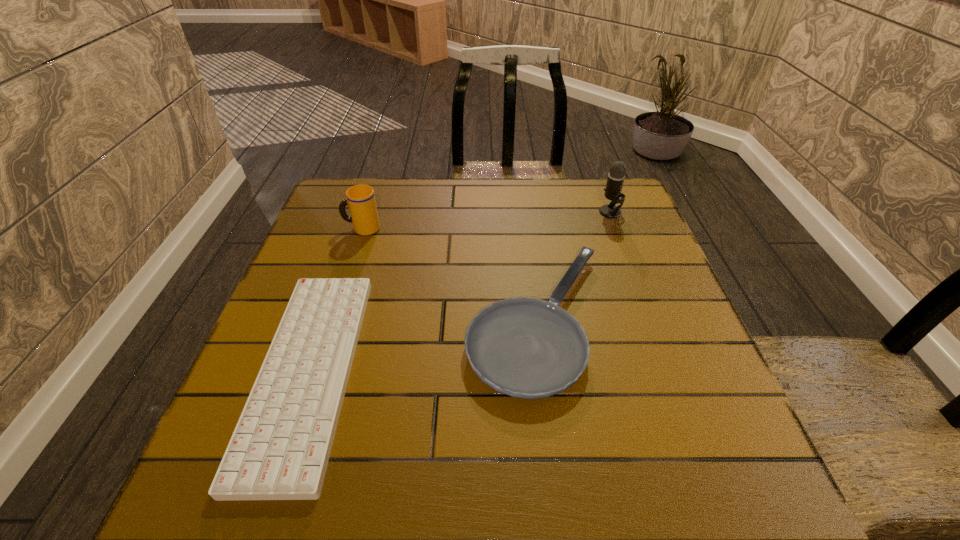
At what (x,y) coordinates should I click in order to perform the action: click on microphone located in the far edge section of the desktop. Please return your answer as a coordinate pair (x, y). This screenshot has width=960, height=540. Looking at the image, I should click on (616, 176).

Where is `cup present at the far edge`? This screenshot has height=540, width=960. cup present at the far edge is located at coordinates (361, 200).

Identify the location of object present at the near edge. The image size is (960, 540). [280, 448].

Find the location of a particular element. cup at the left edge is located at coordinates (361, 200).

The height and width of the screenshot is (540, 960). I want to click on computer keyboard at the left edge, so click(x=280, y=448).

The image size is (960, 540). I want to click on object located at the right edge, so click(616, 176).

At what (x,y) coordinates should I click in order to perform the action: click on object that is at the far left corner. Please return your answer as a coordinate pair (x, y). Looking at the image, I should click on [x=361, y=200].

Where is `object that is at the near left corner`? This screenshot has width=960, height=540. object that is at the near left corner is located at coordinates (280, 448).

Image resolution: width=960 pixels, height=540 pixels. I want to click on object that is positioned at the far right corner, so click(x=616, y=176).

You are a GUI agent. You are given a task and a screenshot of the screen. Output one action in this format:
    pyautogui.click(x=<x>, y=<y>)
    Task: Click on the free point at the far edge
    
    Given the screenshot: What is the action you would take?
    pyautogui.click(x=464, y=212)